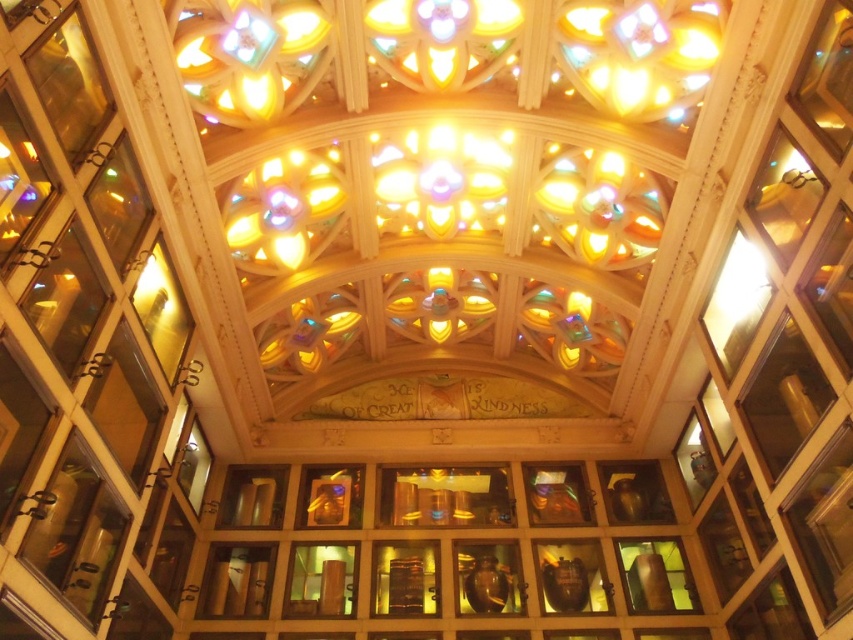
Is transparent glass at center to the right of clear glass at left from the viewer's perspective?

Indeed, transparent glass at center is positioned on the right side of clear glass at left.

Does transparent glass at center have a lesser width compared to clear glass at left?

No.

The width and height of the screenshot is (853, 640). Describe the element at coordinates (445, 497) in the screenshot. I see `transparent glass at center` at that location.

The width and height of the screenshot is (853, 640). In order to click on transparent glass at center in this screenshot , I will do `click(445, 497)`.

Based on the photo, which is above, clear glass window at lower left or transparent glass vase at lower right?

clear glass window at lower left is above.

Is point (82, 497) positioned after point (646, 589)?

That is False.

Is point (59, 570) positioned in front of point (625, 570)?

Yes, it is in front of point (625, 570).

The width and height of the screenshot is (853, 640). I want to click on clear glass window at lower left, so click(76, 532).

Can you confirm if transparent glass cabinet at right is positioned above transparent glass at center?

Correct, transparent glass cabinet at right is located above transparent glass at center.

Locate an element on the screen. Image resolution: width=853 pixels, height=640 pixels. transparent glass cabinet at right is located at coordinates (785, 397).